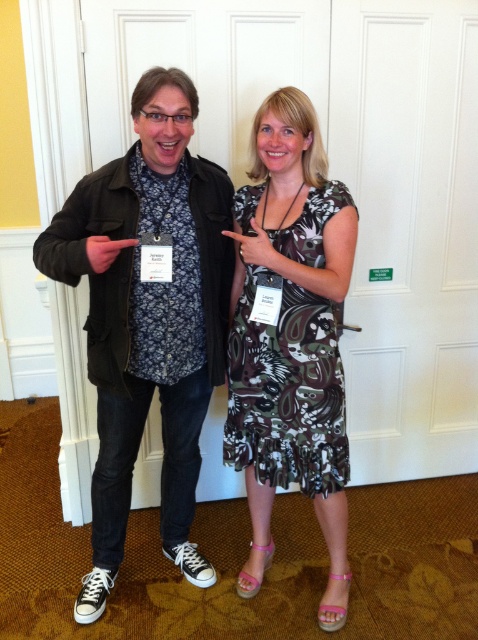
Measure the distance between black matte jacket at center and camera.

A distance of 4.95 feet exists between black matte jacket at center and camera.

Who is more distant from viewer, (x=43, y=266) or (x=224, y=451)?

The point (x=224, y=451) is behind.

Find the location of a particular element. This screenshot has width=478, height=640. black matte jacket at center is located at coordinates (148, 317).